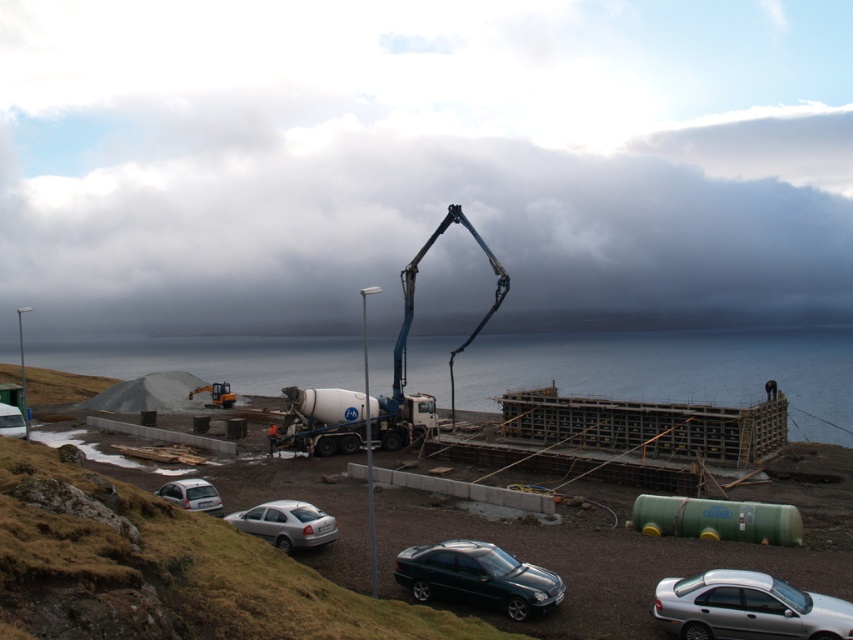
Can you confirm if dark blue water at center is positioned to the left of white concrete mixer at center?

In fact, dark blue water at center is to the right of white concrete mixer at center.

Is dark blue water at center above white concrete mixer at center?

Correct, dark blue water at center is located above white concrete mixer at center.

Identify the location of dark blue water at center. The width and height of the screenshot is (853, 640). (674, 371).

Is the position of dark blue water at center more distant than that of silver metallic car at lower right?

Yes, dark blue water at center is further from the viewer.

Can you confirm if dark blue water at center is taller than silver metallic car at lower right?

Correct, dark blue water at center is much taller as silver metallic car at lower right.

Image resolution: width=853 pixels, height=640 pixels. Identify the location of dark blue water at center. (674, 371).

Does shiny black sedan at center appear over silver metallic sedan at lower center?

Correct, shiny black sedan at center is located above silver metallic sedan at lower center.

Is point (418, 550) positioned in front of point (248, 529)?

Yes, point (418, 550) is closer to viewer.

Where is `shiny black sedan at center`? The height and width of the screenshot is (640, 853). shiny black sedan at center is located at coordinates (477, 577).